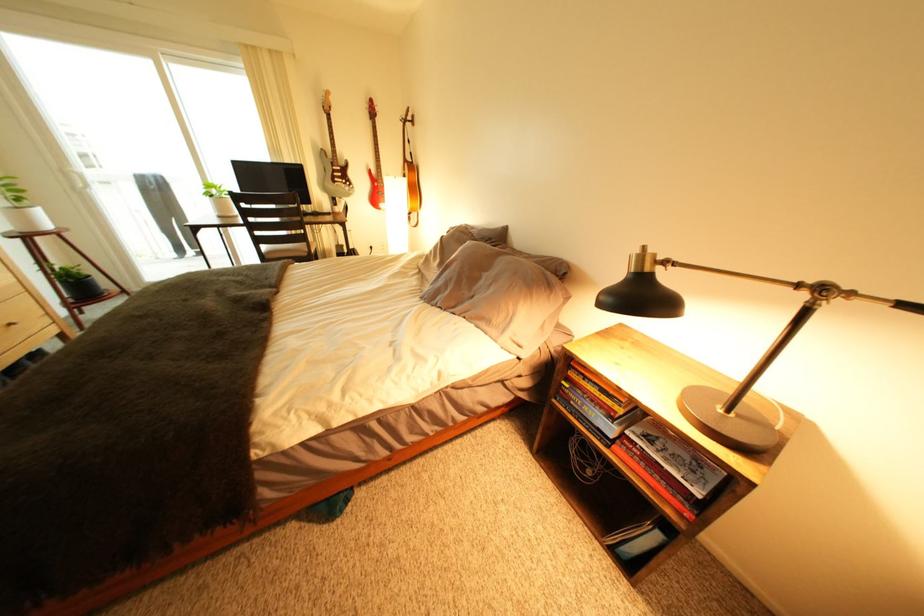
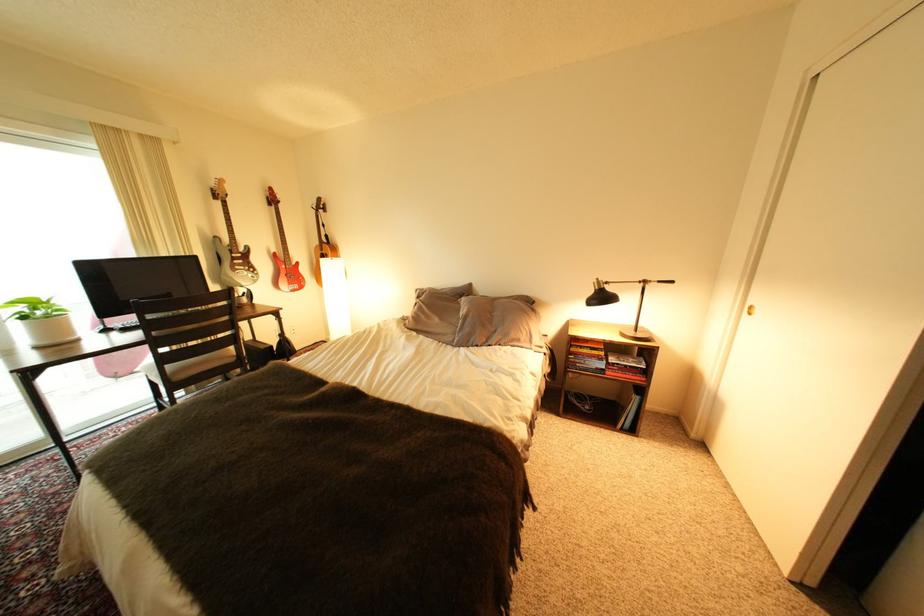
Find the pixel in the second image that matches the point at 345,167 in the first image.

(244, 254)